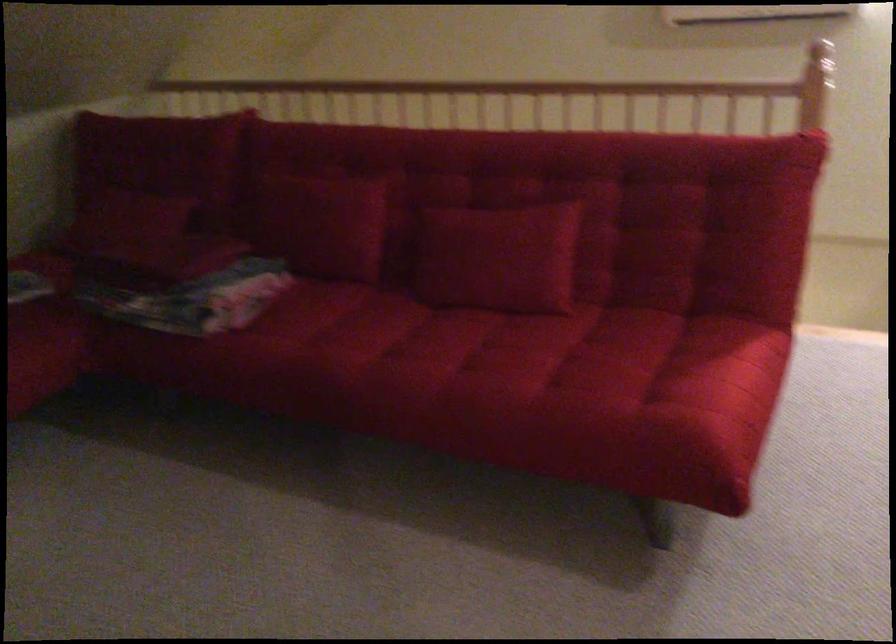
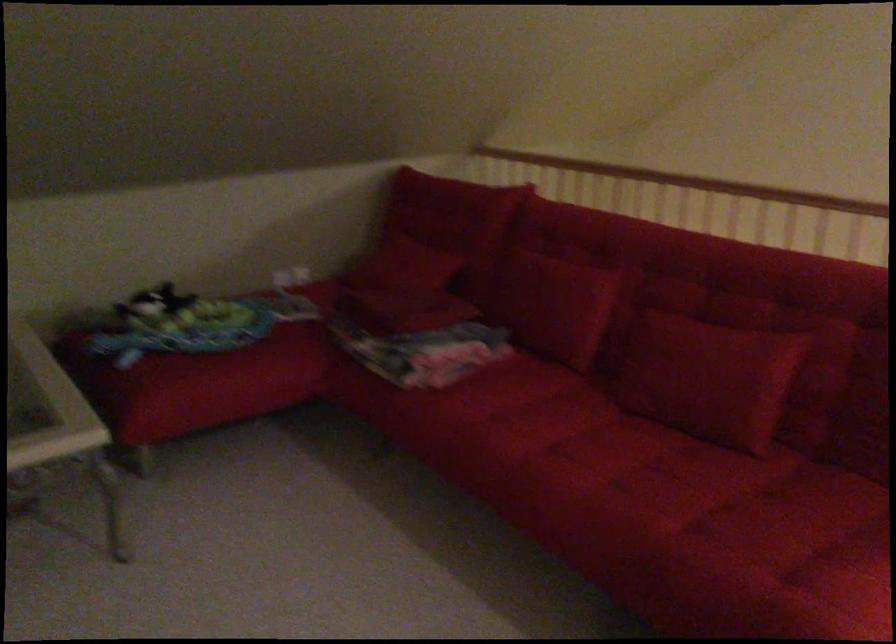
Question: Based on the continuous images, in which direction is the camera rotating? Reply with the corresponding letter.

Choices:
 (A) Left
 (B) Right
 (C) Up
 (D) Down

Answer: (A)